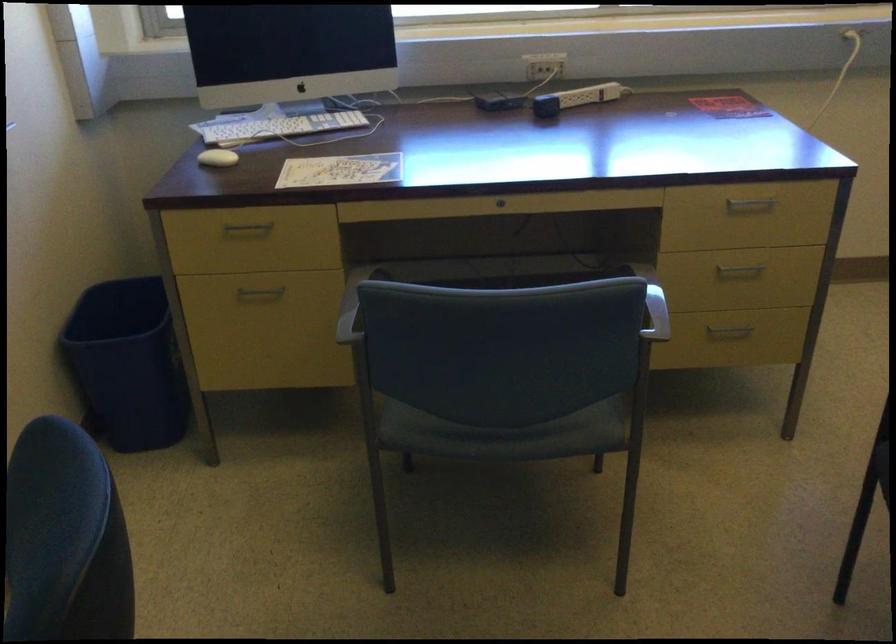
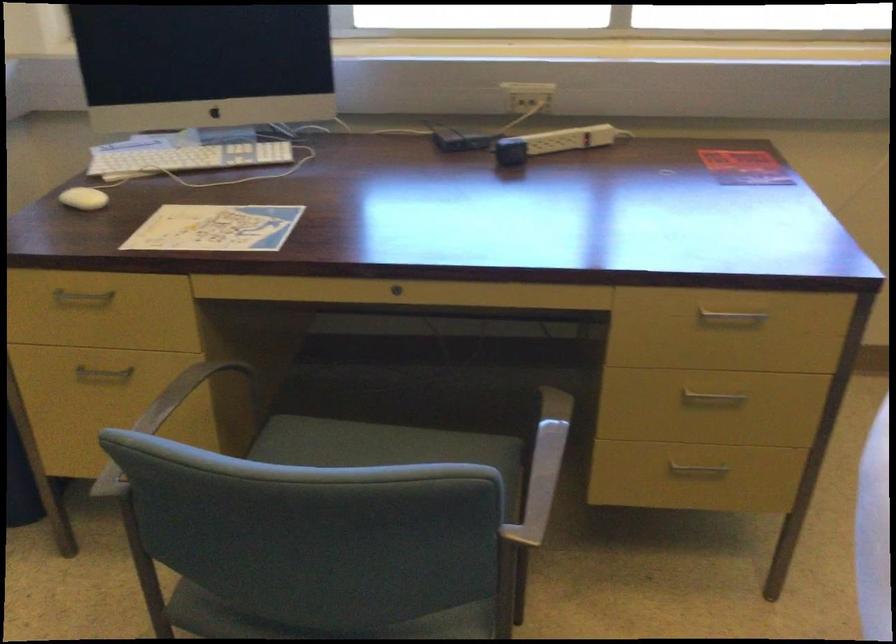
What movement of the cameraman would produce the second image?

The cameraman moved toward right, forward.